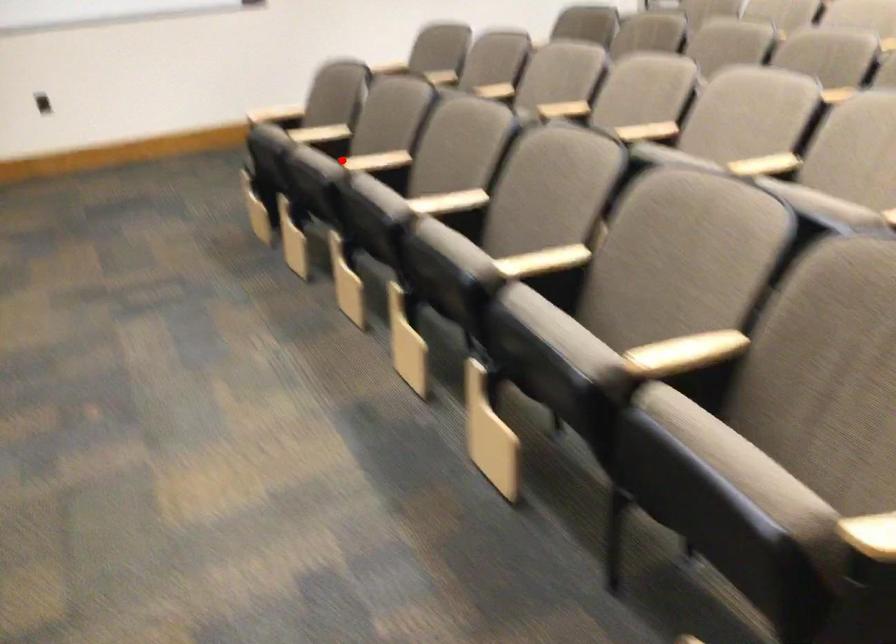
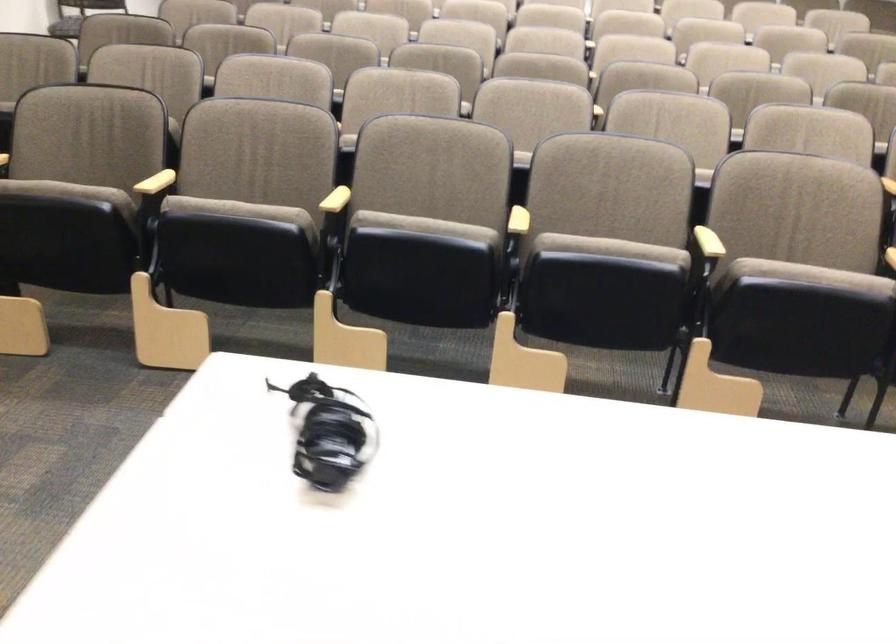
Question: I am providing you with two images of the same scene from different viewpoints. Image1 has a red point marked. In image2, the corresponding 3D location appears at what relative position? Reply with the corresponding letter.

Choices:
 (A) Closer
 (B) Farther

Answer: (A)